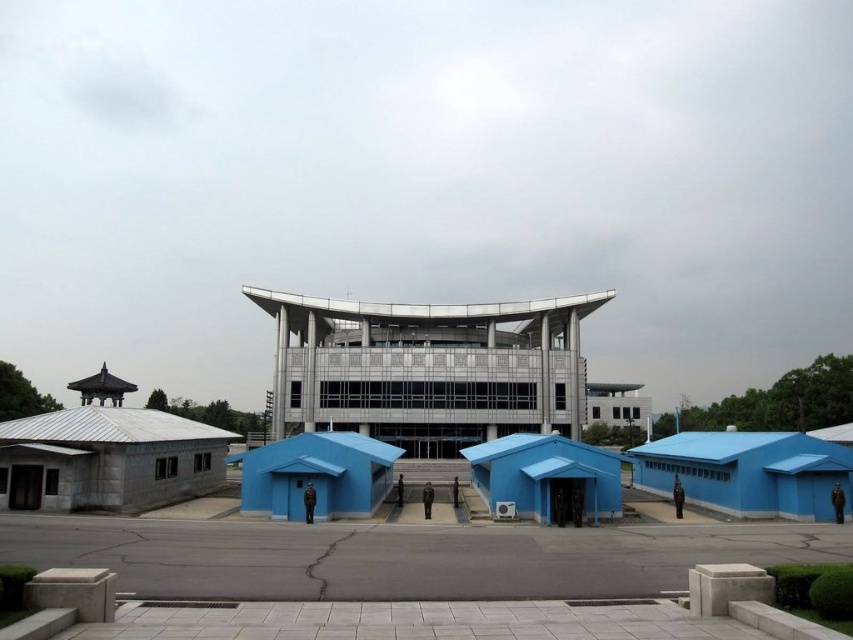
Who is higher up, blue matte shelter at lower right or matte blue shelter at center?

matte blue shelter at center

Does point (798, 502) lie behind point (250, 458)?

No, (798, 502) is closer to viewer.

Which is in front, point (648, 452) or point (390, 472)?

Point (648, 452) is more forward.

The image size is (853, 640). In order to click on blue matte shelter at lower right in this screenshot , I will do `click(747, 472)`.

Who is more distant from viewer, (x=560, y=470) or (x=258, y=465)?

The point (x=258, y=465) is behind.

Who is positioned more to the right, blue matte shelter at center or matte blue shelter at center?

Positioned to the right is blue matte shelter at center.

Locate an element on the screen. blue matte shelter at center is located at coordinates (546, 477).

Which of these two, blue matte shelter at lower right or blue matte shelter at center, stands shorter?

With less height is blue matte shelter at lower right.

Can you confirm if blue matte shelter at lower right is positioned to the left of blue matte shelter at center?

No, blue matte shelter at lower right is not to the left of blue matte shelter at center.

Who is more distant from viewer, (766, 493) or (544, 483)?

Point (766, 493)

At what (x,y) coordinates should I click in order to perform the action: click on blue matte shelter at lower right. Please return your answer as a coordinate pair (x, y). The image size is (853, 640). Looking at the image, I should click on (747, 472).